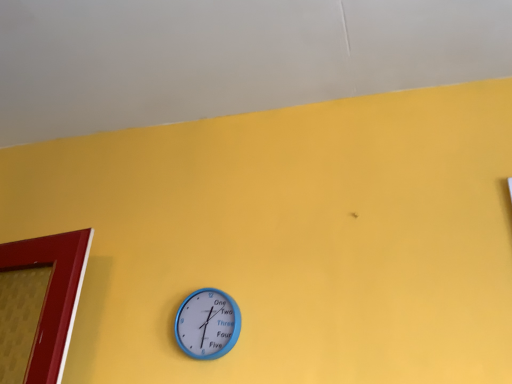
The width and height of the screenshot is (512, 384). What do you see at coordinates (207, 324) in the screenshot? I see `blue plastic wall clock at center` at bounding box center [207, 324].

Where is `blue plastic wall clock at center`? blue plastic wall clock at center is located at coordinates (207, 324).

In order to face blue plastic wall clock at center, should I rotate leftwards or rightwards?

Rotate your view left by about 6.204°.

Find the location of `yellow matte wall at upper center`. yellow matte wall at upper center is located at coordinates (228, 57).

Measure the distance between yellow matte wall at upper center and camera.

A distance of 3.51 feet exists between yellow matte wall at upper center and camera.

Describe the element at coordinates (228, 57) in the screenshot. I see `yellow matte wall at upper center` at that location.

In order to click on blue plastic wall clock at center in this screenshot , I will do `click(207, 324)`.

Would you say blue plastic wall clock at center is to the left or to the right of yellow matte wall at upper center in the picture?

In the image, blue plastic wall clock at center appears on the right side of yellow matte wall at upper center.

Considering the positions of objects blue plastic wall clock at center and yellow matte wall at upper center in the image provided, who is behind, blue plastic wall clock at center or yellow matte wall at upper center?

blue plastic wall clock at center is behind.

Which is less distant, (205, 324) or (431, 83)?

Point (205, 324) appears to be closer to the viewer than point (431, 83).

From the image's perspective, is blue plastic wall clock at center beneath yellow matte wall at upper center?

Yes, from the image's perspective, blue plastic wall clock at center is beneath yellow matte wall at upper center.

From a real-world perspective, is blue plastic wall clock at center physically located above or below yellow matte wall at upper center?

From a real-world perspective, blue plastic wall clock at center is physically below yellow matte wall at upper center.

Considering the sizes of objects blue plastic wall clock at center and yellow matte wall at upper center in the image provided, who is thinner, blue plastic wall clock at center or yellow matte wall at upper center?

blue plastic wall clock at center.

Between blue plastic wall clock at center and yellow matte wall at upper center, which one has less height?

yellow matte wall at upper center.

Is blue plastic wall clock at center smaller than yellow matte wall at upper center?

Yes.

Is blue plastic wall clock at center completely or partially outside of yellow matte wall at upper center?

blue plastic wall clock at center lies outside yellow matte wall at upper center's area.

Would you say blue plastic wall clock at center is a long distance from yellow matte wall at upper center?

No, blue plastic wall clock at center is not far away from yellow matte wall at upper center.

Could you tell me if blue plastic wall clock at center is turned towards yellow matte wall at upper center?

No, blue plastic wall clock at center does not turn towards yellow matte wall at upper center.

Based on the photo, how different are the orientations of blue plastic wall clock at center and yellow matte wall at upper center in degrees?

There is a 90-degree angle between the facing directions of blue plastic wall clock at center and yellow matte wall at upper center.

The image size is (512, 384). What are the coordinates of `backdrop located on the left of blue plastic wall clock at center` in the screenshot? It's located at (228, 57).

Is yellow matte wall at upper center at the right side of blue plastic wall clock at center?

In fact, yellow matte wall at upper center is to the left of blue plastic wall clock at center.

Which is in front, yellow matte wall at upper center or blue plastic wall clock at center?

yellow matte wall at upper center is closer to the camera.

Which point is more distant from viewer, (108,68) or (227,342)?

The point (108,68) is farther from the camera.

From the image's perspective, which one is positioned lower, yellow matte wall at upper center or blue plastic wall clock at center?

blue plastic wall clock at center.

In the scene shown: From a real-world perspective, which object stands above the other?

yellow matte wall at upper center.

Considering the sizes of yellow matte wall at upper center and blue plastic wall clock at center in the image, is yellow matte wall at upper center wider or thinner than blue plastic wall clock at center?

Clearly, yellow matte wall at upper center has more width compared to blue plastic wall clock at center.

Who is shorter, yellow matte wall at upper center or blue plastic wall clock at center?

With less height is yellow matte wall at upper center.

Between yellow matte wall at upper center and blue plastic wall clock at center, which one has larger size?

With larger size is yellow matte wall at upper center.

Is yellow matte wall at upper center completely or partially outside of blue plastic wall clock at center?

Absolutely, yellow matte wall at upper center is external to blue plastic wall clock at center.

Consider the image. Is yellow matte wall at upper center touching blue plastic wall clock at center?

No, yellow matte wall at upper center is not beside blue plastic wall clock at center.

Is blue plastic wall clock at center at the back of yellow matte wall at upper center?

No.

How different are the orientations of yellow matte wall at upper center and blue plastic wall clock at center in degrees?

The angle between the facing direction of yellow matte wall at upper center and the facing direction of blue plastic wall clock at center is 90 degrees.

Find the location of a particular element. The width and height of the screenshot is (512, 384). backdrop in front of the blue plastic wall clock at center is located at coordinates (228, 57).

What are the coordinates of `wall clock behind the yellow matte wall at upper center` in the screenshot? It's located at (207, 324).

The image size is (512, 384). Identify the location of wall clock directly beneath the yellow matte wall at upper center (from a real-world perspective). (207, 324).